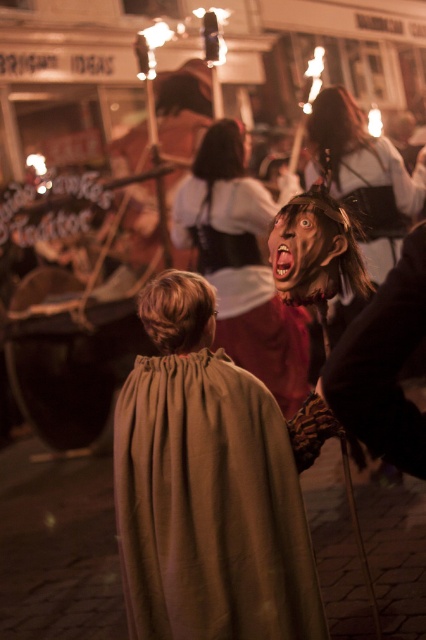
Does point (189, 209) come in front of point (308, 240)?

No, (189, 209) is behind (308, 240).

Does smooth brown mask at center appear over smooth matte face at center?

Actually, smooth brown mask at center is below smooth matte face at center.

Is point (282, 326) closer to viewer compared to point (316, 250)?

That is False.

Locate an element on the screen. smooth brown mask at center is located at coordinates (261, 332).

Which is behind, point (175, 355) or point (279, 243)?

Positioned behind is point (279, 243).

Does brown cotton cape at center have a greater width compared to smooth matte face at center?

Indeed, brown cotton cape at center has a greater width compared to smooth matte face at center.

Is point (181, 422) positioned before point (284, 291)?

Yes, point (181, 422) is in front of point (284, 291).

The image size is (426, 640). In order to click on brown cotton cape at center in this screenshot , I will do `click(210, 506)`.

The image size is (426, 640). What do you see at coordinates (210, 506) in the screenshot? I see `brown cotton cape at center` at bounding box center [210, 506].

Measure the distance between brown cotton cape at center and camera.

The distance of brown cotton cape at center from camera is 2.15 meters.

You are a GUI agent. You are given a task and a screenshot of the screen. Output one action in this format:
    pyautogui.click(x=<x>, y=<y>)
    Task: Click on the brown cotton cape at center
    
    Given the screenshot: What is the action you would take?
    pyautogui.click(x=210, y=506)